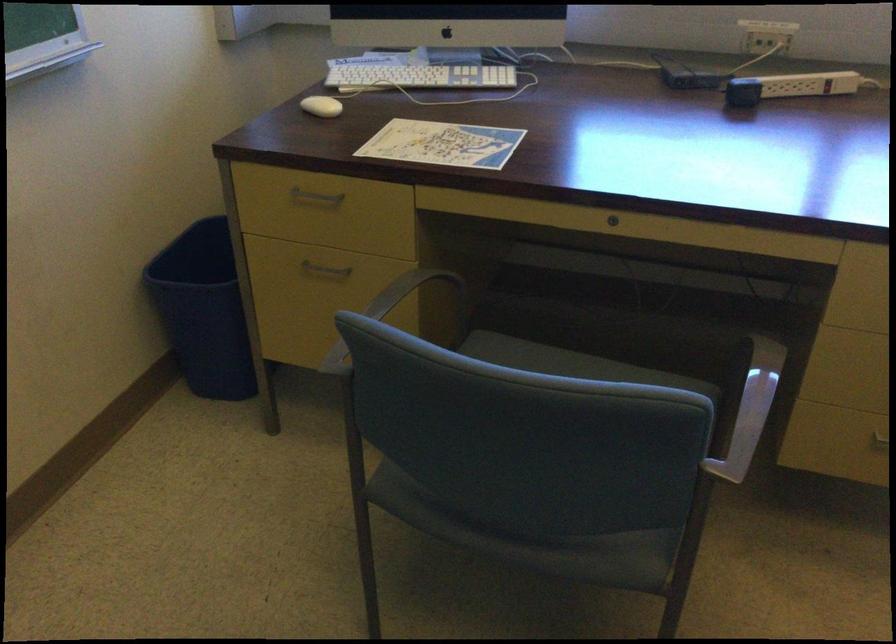
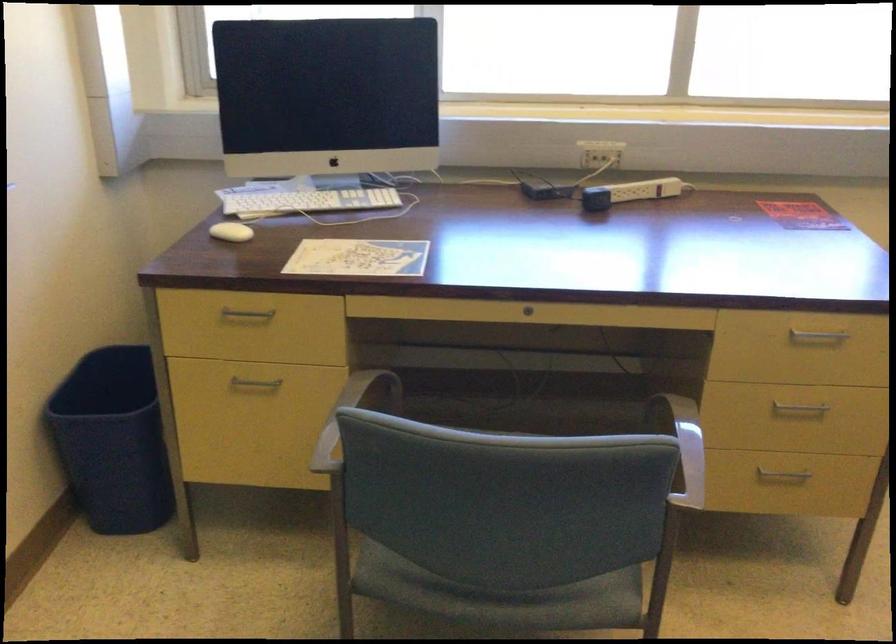
The point at (x=512, y=534) is marked in the first image. Where is the corresponding point in the second image?

(502, 597)